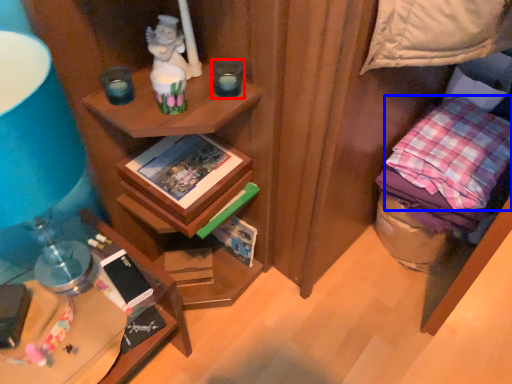
Question: Which object appears farthest to the camera in this image, candle holder (highlighted by a red box) or pillow (highlighted by a blue box)?

Choices:
 (A) candle holder
 (B) pillow

Answer: (B)